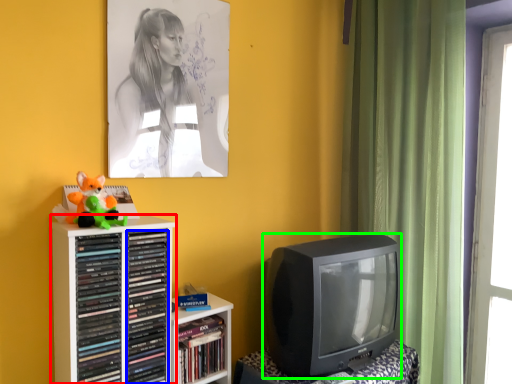
Question: Considering the real-world distances, which object is farthest from shelf (highlighted by a red box)? book (highlighted by a blue box) or television (highlighted by a green box)?

Choices:
 (A) book
 (B) television

Answer: (B)